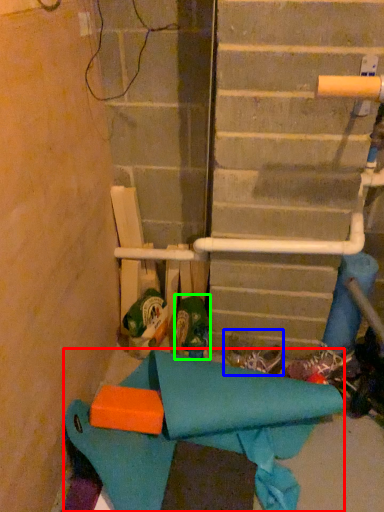
Question: Which object is positioned closest to fabric (highlighted by a red box)? Select from footwear (highlighted by a blue box) and footwear (highlighted by a green box).

Choices:
 (A) footwear
 (B) footwear

Answer: (B)